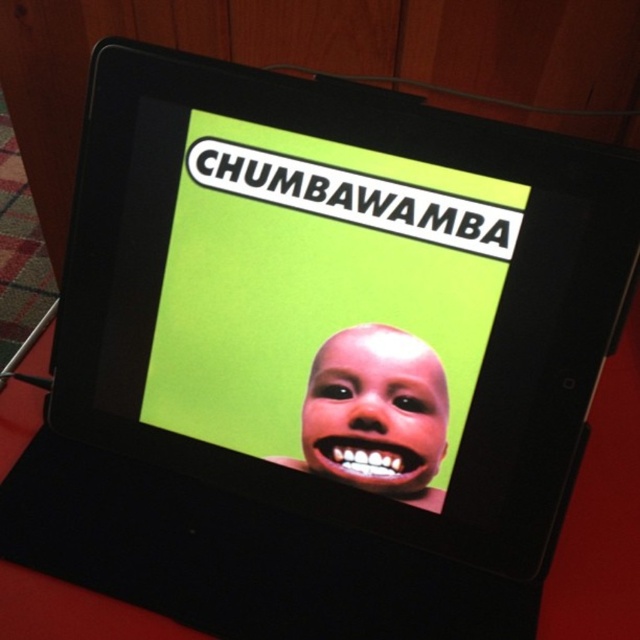
Question: Among these points, which one is nearest to the camera?

Choices:
 (A) (196, 337)
 (B) (444, 454)

Answer: (B)

Question: Can you confirm if green matte poster at center is positioned to the left of smooth skin face at center?

Choices:
 (A) no
 (B) yes

Answer: (B)

Question: Which point is farther to the camera?

Choices:
 (A) (385, 365)
 (B) (307, 458)

Answer: (B)

Question: Can you confirm if green matte poster at center is wider than smooth skin face at center?

Choices:
 (A) no
 (B) yes

Answer: (B)

Question: Among these objects, which one is farthest from the camera?

Choices:
 (A) green matte poster at center
 (B) smooth skin face at center

Answer: (B)

Question: Where is green matte poster at center located in relation to smooth skin face at center in the image?

Choices:
 (A) left
 (B) right

Answer: (A)